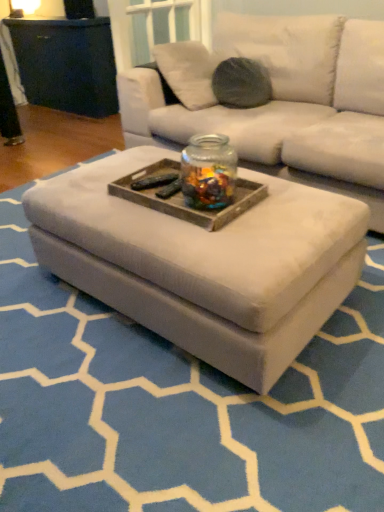
The image size is (384, 512). What are the coordinates of `vacant space situated above wooden tray at center (from a real-world perspective)` in the screenshot? It's located at (195, 186).